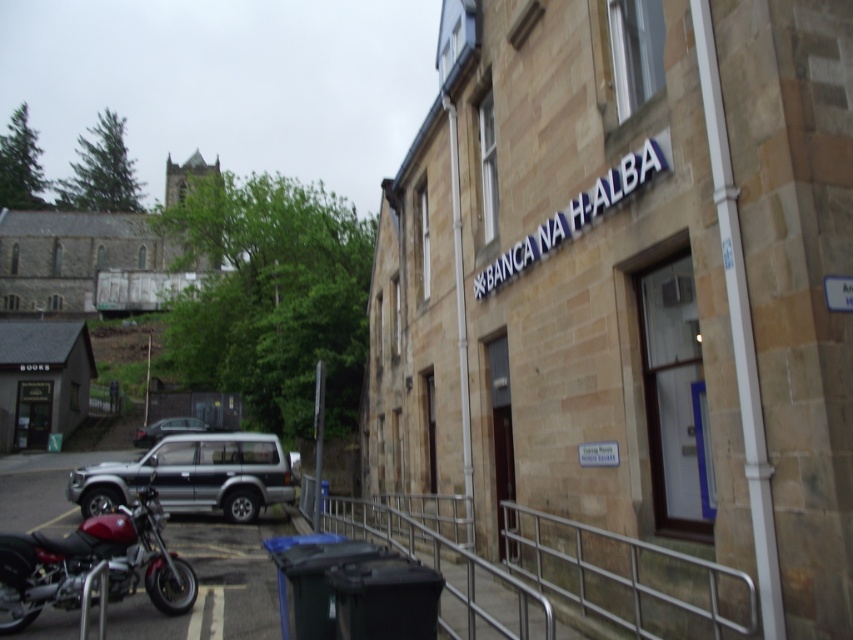
Is silver metallic rail at lower center below silver metallic suv at lower left?

No, silver metallic rail at lower center is not below silver metallic suv at lower left.

Does point (392, 531) come in front of point (184, 492)?

No, it is behind (184, 492).

What are the coordinates of `silver metallic rail at lower center` in the screenshot? It's located at pos(622,577).

Is point (103, 588) closer to camera compared to point (90, 515)?

Yes, it is.

Consider the image. Can you confirm if shiny red motorcycle at lower left is shorter than silver metallic suv at lower left?

Indeed, shiny red motorcycle at lower left has a lesser height compared to silver metallic suv at lower left.

Is point (107, 577) positioned in front of point (160, 499)?

That is True.

Image resolution: width=853 pixels, height=640 pixels. Identify the location of shiny red motorcycle at lower left. (94, 566).

Between silver metallic rail at lower center and shiny red motorcycle at lower left, which one is positioned higher?

shiny red motorcycle at lower left

Which is in front, point (744, 632) or point (115, 566)?

Point (744, 632) is in front.

Does point (723, 625) come closer to viewer compared to point (77, 604)?

Yes, point (723, 625) is closer to viewer.

Where is `silver metallic rail at lower center`? This screenshot has height=640, width=853. silver metallic rail at lower center is located at coordinates (622, 577).